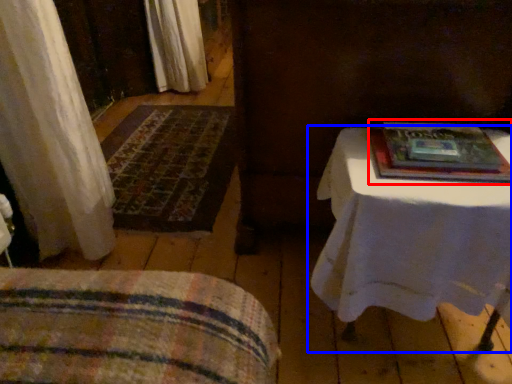
Question: Which of the following is the farthest to the observer, paperback book (highlighted by a red box) or table (highlighted by a blue box)?

Choices:
 (A) paperback book
 (B) table

Answer: (A)